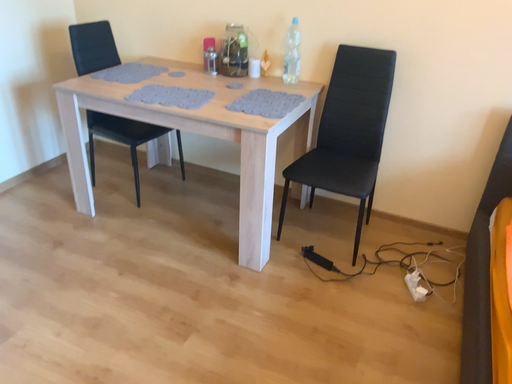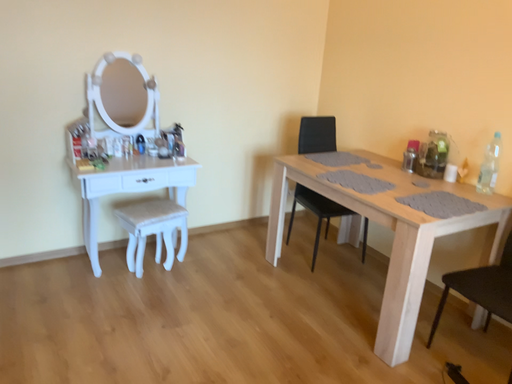
Question: Which way did the camera rotate in the video?

Choices:
 (A) rotated right
 (B) rotated left

Answer: (B)